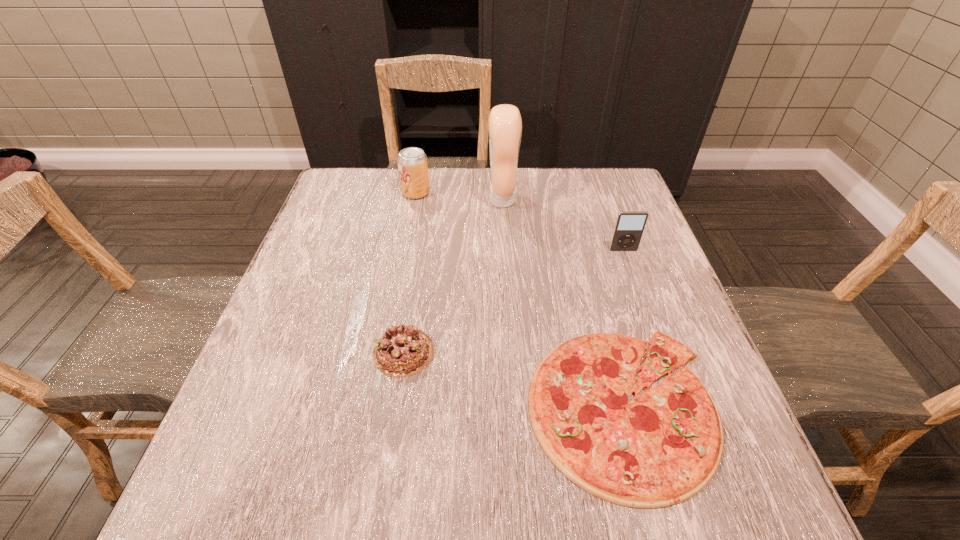
The height and width of the screenshot is (540, 960). Identify the location of vacant space at the right edge. (675, 287).

You are a GUI agent. You are given a task and a screenshot of the screen. Output one action in this format:
    pyautogui.click(x=<x>, y=<y>)
    Task: Click on the free location at the far left corner
    
    Given the screenshot: What is the action you would take?
    pyautogui.click(x=366, y=203)

Find the location of `empty space between the chocolate cake and the pop (soda)`. empty space between the chocolate cake and the pop (soda) is located at coordinates (410, 272).

At what (x,y) coordinates should I click in order to perform the action: click on unoccupied position between the tallest object and the third nearest object. Please return your answer as a coordinate pair (x, y). This screenshot has height=540, width=960. Looking at the image, I should click on (563, 225).

At what (x,y) coordinates should I click in order to perform the action: click on free spot between the fourth tallest object and the pop (soda). Please return your answer as a coordinate pair (x, y). The width and height of the screenshot is (960, 540). Looking at the image, I should click on (410, 272).

Locate an element on the screen. unoccupied position between the condiment and the shortest object is located at coordinates (563, 303).

Identify the location of empty location between the chocolate cake and the pop (soda). (410, 272).

Locate an element on the screen. Image resolution: width=960 pixels, height=540 pixels. free spot between the second shortest object and the pop (soda) is located at coordinates (410, 272).

You are a GUI agent. You are given a task and a screenshot of the screen. Output one action in this format:
    pyautogui.click(x=<x>, y=<y>)
    Task: Click on the vacant space that's between the tallest object and the chocolate cake
    The height and width of the screenshot is (540, 960).
    Given the screenshot: What is the action you would take?
    pyautogui.click(x=453, y=276)

Find the location of a particular element. free point between the tallest object and the pop (soda) is located at coordinates (459, 196).